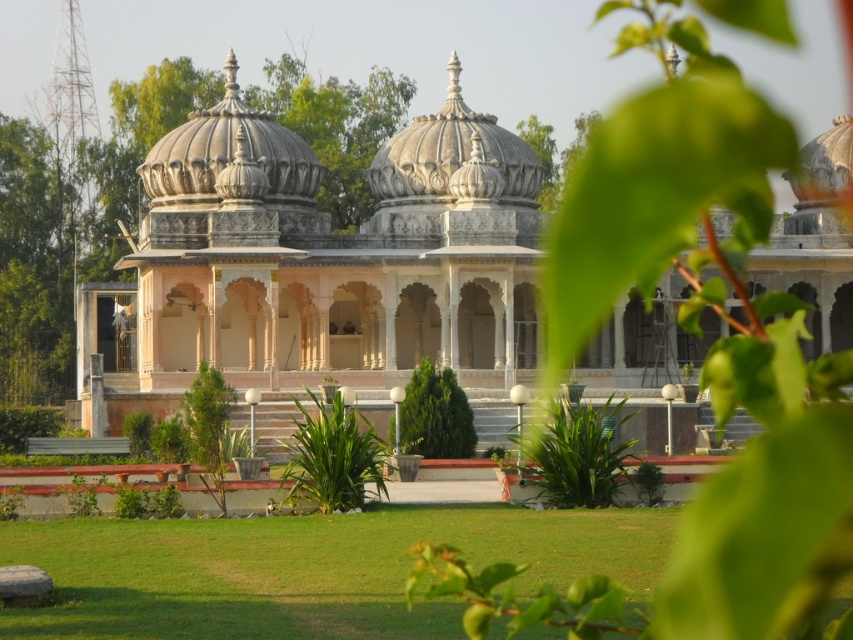
Question: Is white marble palace at center to the right of white stone dome at center from the viewer's perspective?

Choices:
 (A) yes
 (B) no

Answer: (A)

Question: Among these points, which one is nearest to the camera?

Choices:
 (A) (425, 420)
 (B) (389, 134)

Answer: (A)

Question: Which object is the farthest from the white stone dome at center?

Choices:
 (A) white marble palace at center
 (B) green leafy tree at center

Answer: (B)

Question: Does white marble palace at center appear on the left side of white stone dome at center?

Choices:
 (A) yes
 (B) no

Answer: (B)

Question: Is white marble palace at center further to the viewer compared to green leafy tree at center?

Choices:
 (A) yes
 (B) no

Answer: (B)

Question: Which object appears farthest from the camera in this image?

Choices:
 (A) green leafy tree at center
 (B) white marble palace at center
 (C) white stone dome at center

Answer: (C)